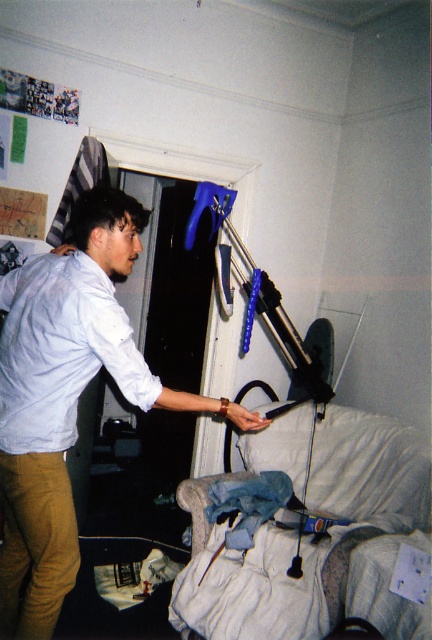
Image resolution: width=432 pixels, height=640 pixels. I want to click on light blue cotton shirt at center, so click(66, 396).

Can you confirm if light blue cotton shirt at center is smaller than light blue cotton shirt at left?

No.

Identify the location of light blue cotton shirt at center. (66, 396).

Does velvet blue hospital bed at lower right appear on the left side of light blue cotton shirt at left?

Incorrect, velvet blue hospital bed at lower right is not on the left side of light blue cotton shirt at left.

Can you confirm if velvet blue hospital bed at lower right is positioned above light blue cotton shirt at left?

Actually, velvet blue hospital bed at lower right is below light blue cotton shirt at left.

Between point (320, 484) and point (41, 269), which one is positioned behind?

Positioned behind is point (320, 484).

Find the location of a particular element. This screenshot has width=432, height=640. velvet blue hospital bed at lower right is located at coordinates (307, 538).

Between light blue cotton shirt at center and velvet blue hospital bed at lower right, which one appears on the left side from the viewer's perspective?

light blue cotton shirt at center is more to the left.

Which of these two, light blue cotton shirt at center or velvet blue hospital bed at lower right, stands taller?

Standing taller between the two is light blue cotton shirt at center.

Is point (69, 483) in front of point (428, 508)?

Yes, point (69, 483) is closer to viewer.

At what (x,y) coordinates should I click in order to perform the action: click on light blue cotton shirt at center. Please return your answer as a coordinate pair (x, y). Image resolution: width=432 pixels, height=640 pixels. Looking at the image, I should click on (66, 396).